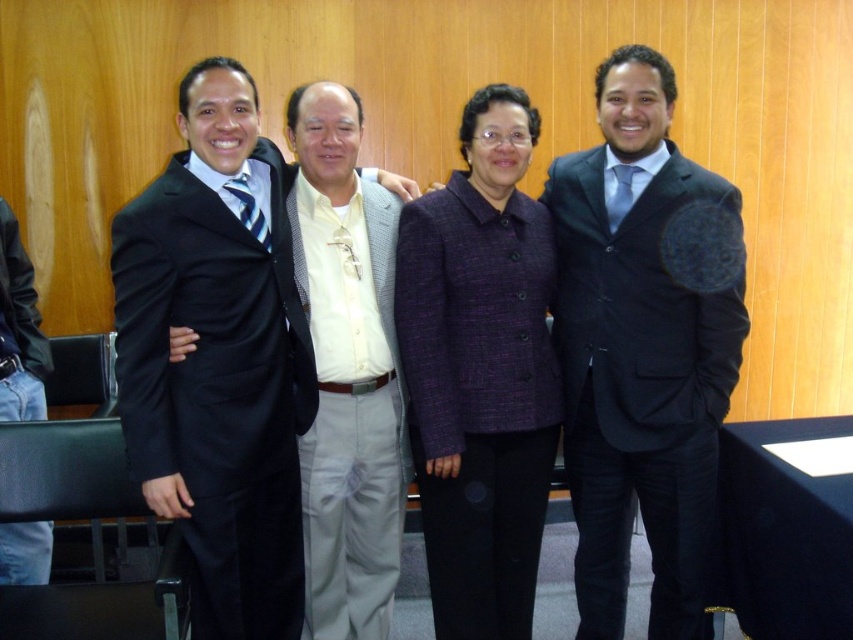
Between matte black suit at right and white textured shirt at center, which one appears on the left side from the viewer's perspective?

From the viewer's perspective, white textured shirt at center appears more on the left side.

Is point (703, 586) closer to camera compared to point (312, 188)?

No.

Is point (701, 508) positioned in front of point (369, 515)?

Yes, it is in front of point (369, 515).

Where is `matte black suit at right`? matte black suit at right is located at coordinates tap(643, 374).

Can you confirm if matte black suit at left is positioned below matte black suit at right?

No.

Is matte black suit at left further to the viewer compared to matte black suit at right?

No, it is not.

I want to click on matte black suit at left, so click(x=218, y=358).

This screenshot has height=640, width=853. In order to click on matte black suit at left in this screenshot , I will do `click(218, 358)`.

Between purple textured blazer at center and white textured shirt at center, which one is positioned higher?

purple textured blazer at center

What do you see at coordinates (480, 371) in the screenshot? This screenshot has height=640, width=853. I see `purple textured blazer at center` at bounding box center [480, 371].

Between point (424, 310) and point (305, 280), which one is positioned in front?

Point (424, 310)

Locate an element on the screen. purple textured blazer at center is located at coordinates (480, 371).